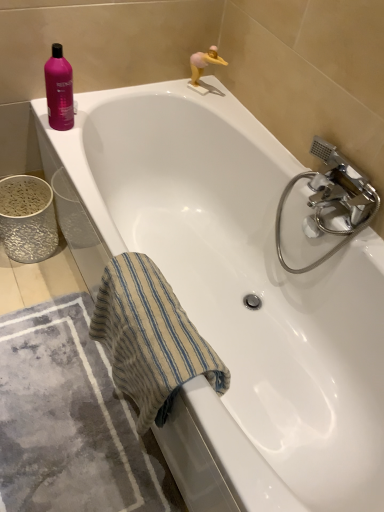
Describe the element at coordinates (150, 338) in the screenshot. This screenshot has height=512, width=384. I see `beige striped towel at lower left` at that location.

You are a GUI agent. You are given a task and a screenshot of the screen. Output one action in this format:
    pyautogui.click(x=<x>, y=<y>)
    Task: Click on the beige striped towel at lower left
    This screenshot has height=512, width=384.
    Given the screenshot: What is the action you would take?
    pyautogui.click(x=150, y=338)

Locate an element on the screen. This screenshot has height=512, width=384. chrome metallic faucet at right is located at coordinates (333, 199).

From the image's perspective, between pink matte figurine at upper right and gray textured bath mat at lower left, who is located below?

From the image's view, gray textured bath mat at lower left is below.

Considering the sizes of pink matte figurine at upper right and gray textured bath mat at lower left in the image, is pink matte figurine at upper right wider or thinner than gray textured bath mat at lower left?

In the image, pink matte figurine at upper right appears to be more narrow than gray textured bath mat at lower left.

The image size is (384, 512). Identify the location of toy to the right of gray textured bath mat at lower left. (204, 63).

Is pink matte figurine at upper right aimed at gray textured bath mat at lower left?

No.

Is point (349, 177) positioned in front of point (55, 68)?

Yes.

Can you confirm if chrome metallic faucet at right is thinner than pink glossy shampoo at upper left?

Incorrect, the width of chrome metallic faucet at right is not less than that of pink glossy shampoo at upper left.

Consider the image. From the image's perspective, between chrome metallic faucet at right and pink glossy shampoo at upper left, who is located below?

chrome metallic faucet at right appears lower in the image.

From a real-world perspective, which object stands above the other?

From a 3D spatial view, pink glossy shampoo at upper left is above.

Looking at this image, from a real-world perspective, relative to pink glossy shampoo at upper left, is gray textured bath mat at lower left vertically above or below?

gray textured bath mat at lower left is situated lower than pink glossy shampoo at upper left in the real world.

Is gray textured bath mat at lower left situated inside pink glossy shampoo at upper left or outside?

gray textured bath mat at lower left is spatially situated outside pink glossy shampoo at upper left.

Is gray textured bath mat at lower left not near pink glossy shampoo at upper left?

No, gray textured bath mat at lower left is in close proximity to pink glossy shampoo at upper left.

Relative to pink glossy shampoo at upper left, is gray textured bath mat at lower left in front or behind?

gray textured bath mat at lower left is in front of pink glossy shampoo at upper left.

From a real-world perspective, between beige striped towel at lower left and pink matte figurine at upper right, who is vertically lower?

beige striped towel at lower left is physically lower.

Can you confirm if beige striped towel at lower left is positioned to the right of pink matte figurine at upper right?

Incorrect, beige striped towel at lower left is not on the right side of pink matte figurine at upper right.

Is beige striped towel at lower left next to pink matte figurine at upper right?

They are not placed beside each other.

Which of these two, beige striped towel at lower left or pink matte figurine at upper right, is bigger?

beige striped towel at lower left.

Which of these two, beige striped towel at lower left or chrome metallic faucet at right, is bigger?

Bigger between the two is beige striped towel at lower left.

Is beige striped towel at lower left in front of or behind chrome metallic faucet at right in the image?

Visually, beige striped towel at lower left is located in front of chrome metallic faucet at right.

Based on the photo, is beige striped towel at lower left inside or outside of chrome metallic faucet at right?

beige striped towel at lower left cannot be found inside chrome metallic faucet at right.

Is point (159, 339) positioned before point (321, 178)?

Yes, point (159, 339) is closer to viewer.

Would you say beige striped towel at lower left is outside pink glossy shampoo at upper left?

Yes.

Is pink glossy shampoo at upper left at the back of beige striped towel at lower left?

No.

From the image's perspective, which is above, beige striped towel at lower left or pink glossy shampoo at upper left?

From the image's view, pink glossy shampoo at upper left is above.

Between beige striped towel at lower left and pink glossy shampoo at upper left, which one is positioned behind?

Positioned behind is pink glossy shampoo at upper left.

Does chrome metallic faucet at right turn towards pink matte figurine at upper right?

No, chrome metallic faucet at right is not oriented towards pink matte figurine at upper right.

Considering the sizes of objects chrome metallic faucet at right and pink matte figurine at upper right in the image provided, who is taller, chrome metallic faucet at right or pink matte figurine at upper right?

chrome metallic faucet at right.

From the picture: Is chrome metallic faucet at right not close to pink matte figurine at upper right?

No, there isn't a large distance between chrome metallic faucet at right and pink matte figurine at upper right.

How different are the orientations of chrome metallic faucet at right and pink matte figurine at upper right in degrees?

The angular difference between chrome metallic faucet at right and pink matte figurine at upper right is 28.1 degrees.

The height and width of the screenshot is (512, 384). In order to click on bath mat lying on the left of pink matte figurine at upper right in this screenshot , I will do `click(70, 421)`.

The width and height of the screenshot is (384, 512). In order to click on cleaning product above the chrome metallic faucet at right (from the image's perspective) in this screenshot , I will do `click(59, 90)`.

Estimate the real-world distances between objects in this image. Which object is closer to pink matte figurine at upper right, chrome metallic faucet at right or gray textured bath mat at lower left?

chrome metallic faucet at right is closer to pink matte figurine at upper right.

Looking at the image, which one is located further to beige striped towel at lower left, chrome metallic faucet at right or pink matte figurine at upper right?

pink matte figurine at upper right.

From the image, which object appears to be farther from beige striped towel at lower left, pink matte figurine at upper right or gray textured bath mat at lower left?

pink matte figurine at upper right is positioned further to the anchor beige striped towel at lower left.

From the image, which object appears to be farther from chrome metallic faucet at right, beige striped towel at lower left or pink matte figurine at upper right?

pink matte figurine at upper right lies further to chrome metallic faucet at right than the other object.

From the image, which object appears to be farther from beige striped towel at lower left, gray textured bath mat at lower left or chrome metallic faucet at right?

Based on the image, chrome metallic faucet at right appears to be further to beige striped towel at lower left.

Looking at the image, which one is located further to gray textured bath mat at lower left, beige striped towel at lower left or pink glossy shampoo at upper left?

Among the two, pink glossy shampoo at upper left is located further to gray textured bath mat at lower left.

Which object lies nearer to the anchor point gray textured bath mat at lower left, pink glossy shampoo at upper left or chrome metallic faucet at right?

Based on the image, pink glossy shampoo at upper left appears to be nearer to gray textured bath mat at lower left.

Based on their spatial positions, is pink matte figurine at upper right or pink glossy shampoo at upper left closer to beige striped towel at lower left?

Based on the image, pink glossy shampoo at upper left appears to be nearer to beige striped towel at lower left.

You are a GUI agent. You are given a task and a screenshot of the screen. Output one action in this format:
    pyautogui.click(x=<x>, y=<y>)
    Task: Click on the cleaning product that lies between pink matte figurine at upper right and beige striped towel at lower left from top to bottom
    The height and width of the screenshot is (512, 384).
    Given the screenshot: What is the action you would take?
    pyautogui.click(x=59, y=90)

Locate an element on the screen. The height and width of the screenshot is (512, 384). cleaning product that lies between pink matte figurine at upper right and gray textured bath mat at lower left from top to bottom is located at coordinates (59, 90).

The height and width of the screenshot is (512, 384). What are the coordinates of `beach towel located between gray textured bath mat at lower left and chrome metallic faucet at right in the left-right direction` in the screenshot? It's located at (150, 338).

Find the location of a particular element. This screenshot has height=512, width=384. tap between pink matte figurine at upper right and gray textured bath mat at lower left in the vertical direction is located at coordinates (333, 199).